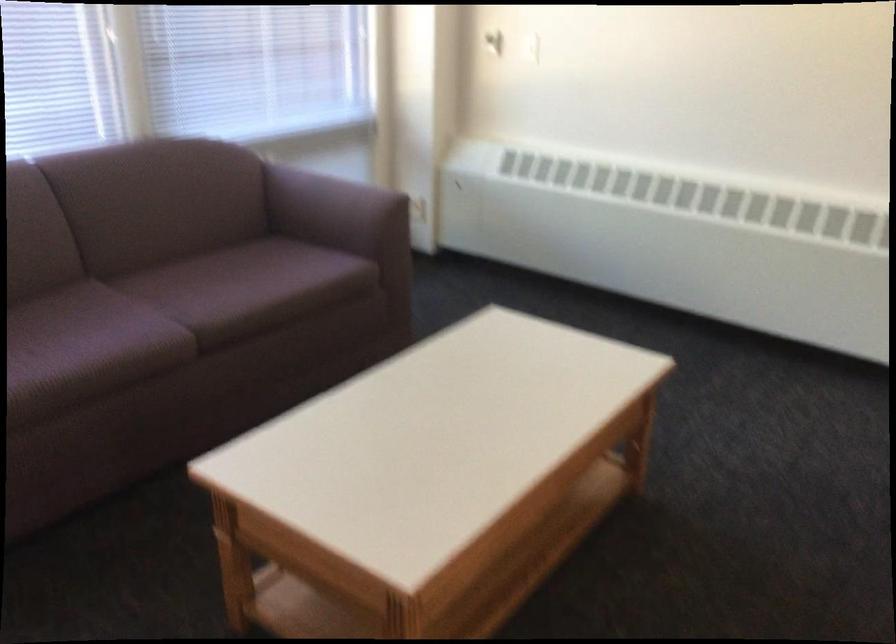
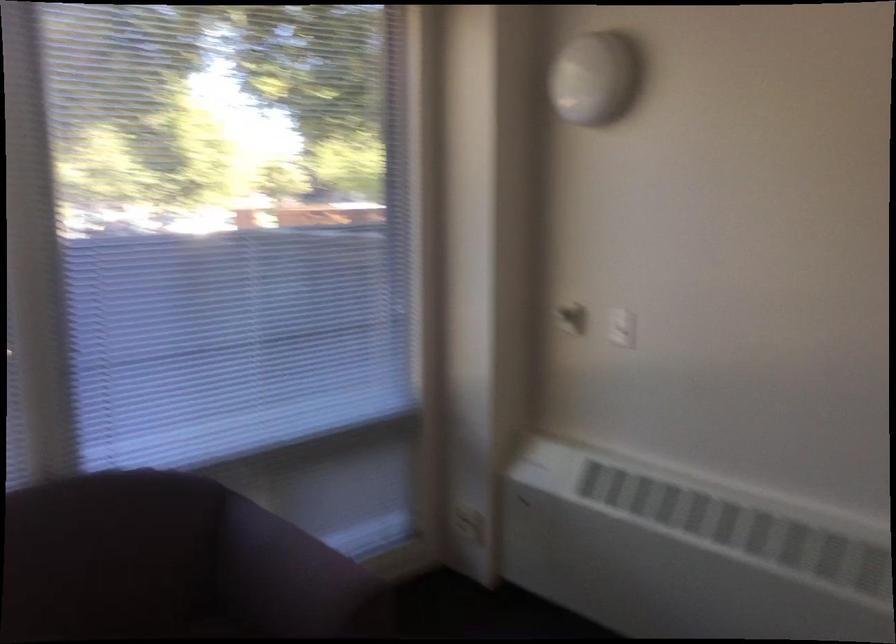
The images are taken continuously from a first-person perspective. In which direction are you moving?

The cameraman moved toward right, forward.